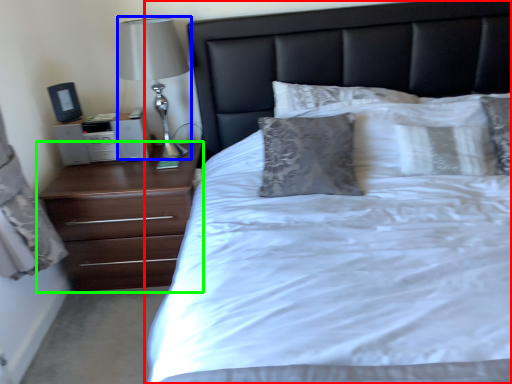
Question: Which object is positioned farthest from bed (highlighted by a red box)? Select from table lamp (highlighted by a blue box) and chest of drawers (highlighted by a green box).

Choices:
 (A) table lamp
 (B) chest of drawers

Answer: (A)